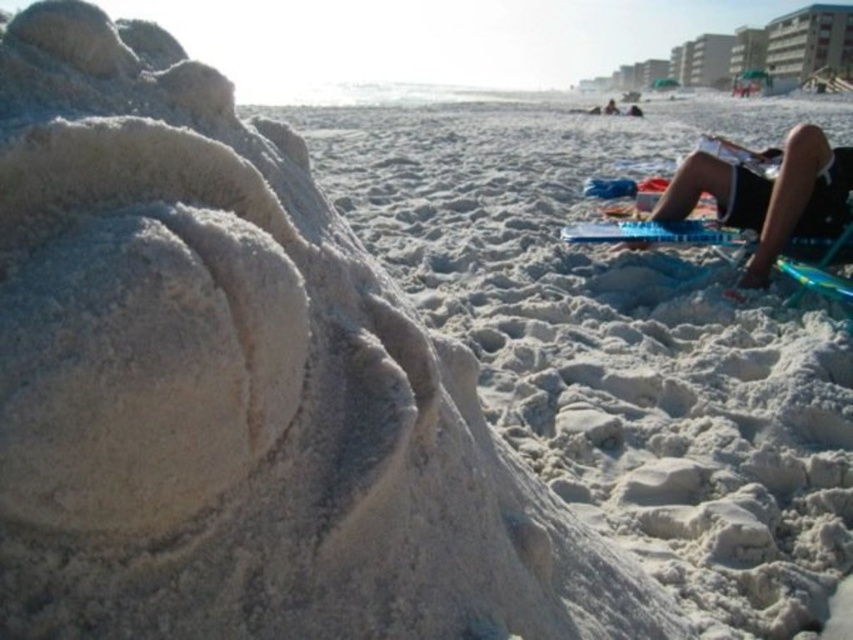
Is white sandcastle at left shorter than black fabric shorts at upper right?

In fact, white sandcastle at left may be taller than black fabric shorts at upper right.

Which is below, white sandcastle at left or black fabric shorts at upper right?

black fabric shorts at upper right

Is point (729, 595) positioned in front of point (740, 195)?

Yes, it is in front of point (740, 195).

Locate an element on the screen. white sandcastle at left is located at coordinates (619, 340).